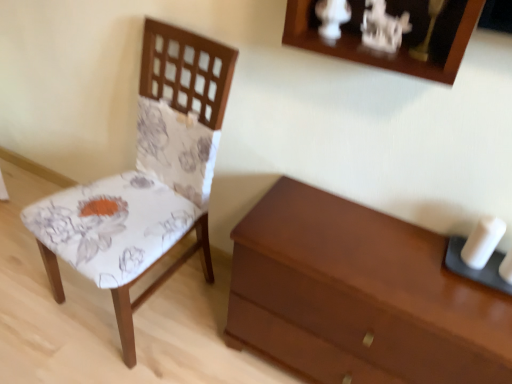
Question: Is point (195, 91) positioned closer to the camera than point (498, 220)?

Choices:
 (A) farther
 (B) closer

Answer: (A)

Question: Considering the positions of floral fabric chair at left and white matte candle at right in the image, is floral fabric chair at left bigger or smaller than white matte candle at right?

Choices:
 (A) big
 (B) small

Answer: (A)

Question: Based on their relative distances, which object is farther from the matte brown chest of drawers at lower right?

Choices:
 (A) white matte candle at right
 (B) floral fabric chair at left

Answer: (B)

Question: Which of these objects is positioned farthest from the matte brown chest of drawers at lower right?

Choices:
 (A) floral fabric chair at left
 (B) white matte candle at right

Answer: (A)